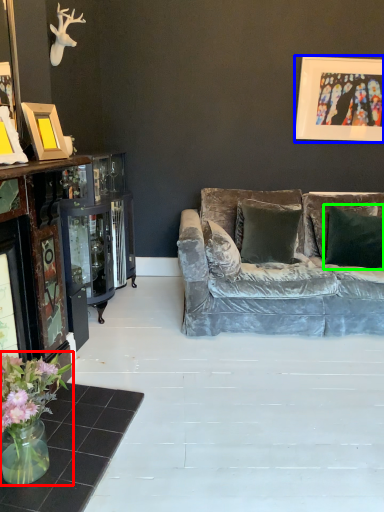
Question: Considering the real-world distances, which object is farthest from floral arrangement (highlighted by a red box)? picture frame (highlighted by a blue box) or pillow (highlighted by a green box)?

Choices:
 (A) picture frame
 (B) pillow

Answer: (A)